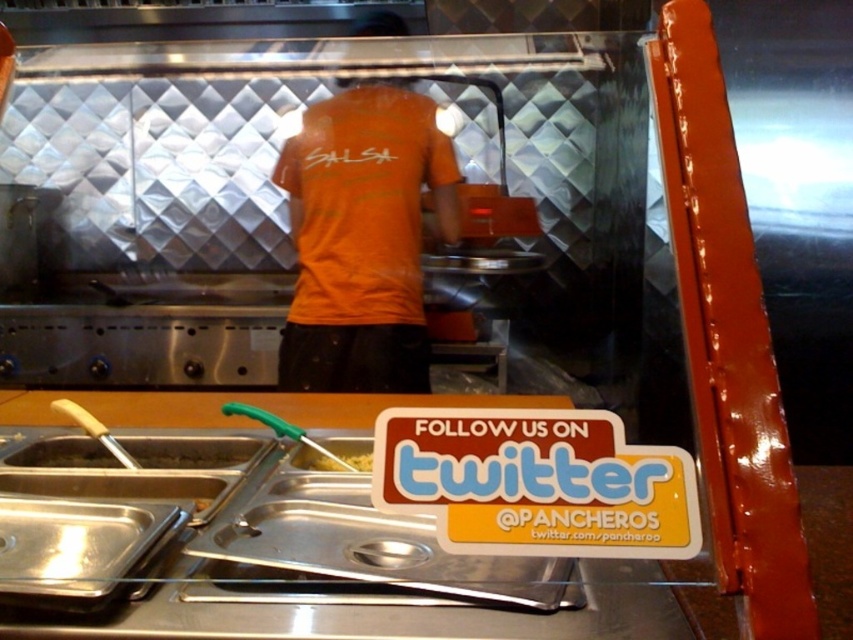
You are a customer observing the orange matte shirt at center and the white plastic sign at lower center through the glass barrier. Which object is wider from your perspective?

The orange matte shirt at center is wider than the white plastic sign at lower center.

You are a customer at the food counter and want to know if the metallic silver tray at lower left can hold the yellow matte pasta at center. Can you determine this based on their sizes?

The metallic silver tray at lower left is wider than the yellow matte pasta at center, so it can hold the pasta.